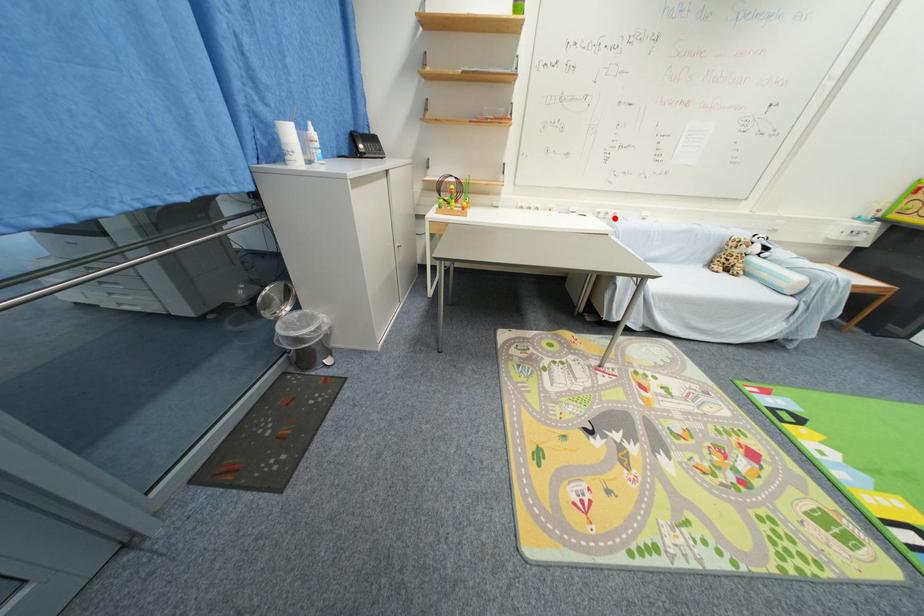
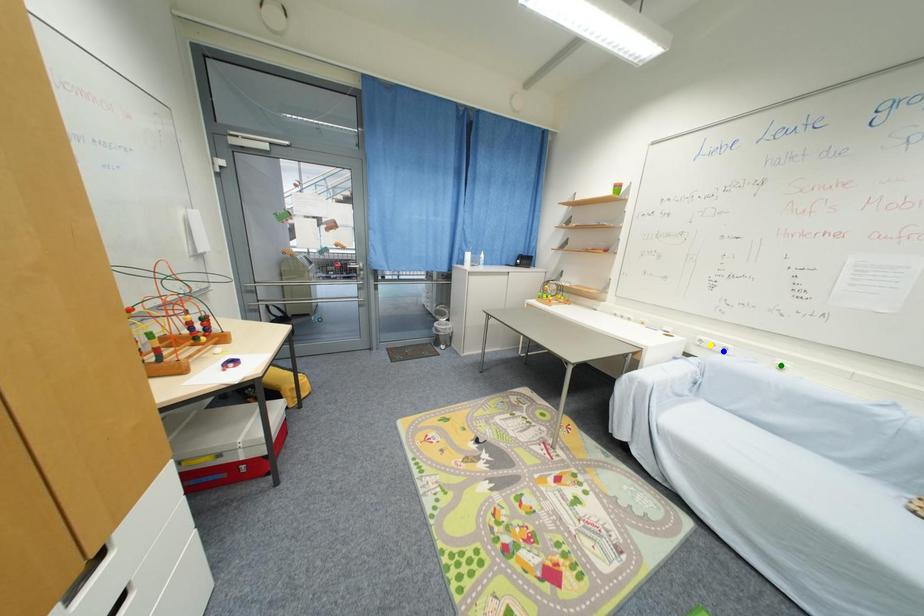
Question: I am providing you with two images of the same scene from different viewpoints. A red point is marked on the first image. You are given multiple points on the second image. Which spot in image 2 lines up with the point in image 1?

Choices:
 (A) yellow point
 (B) green point
 (C) blue point

Answer: (C)